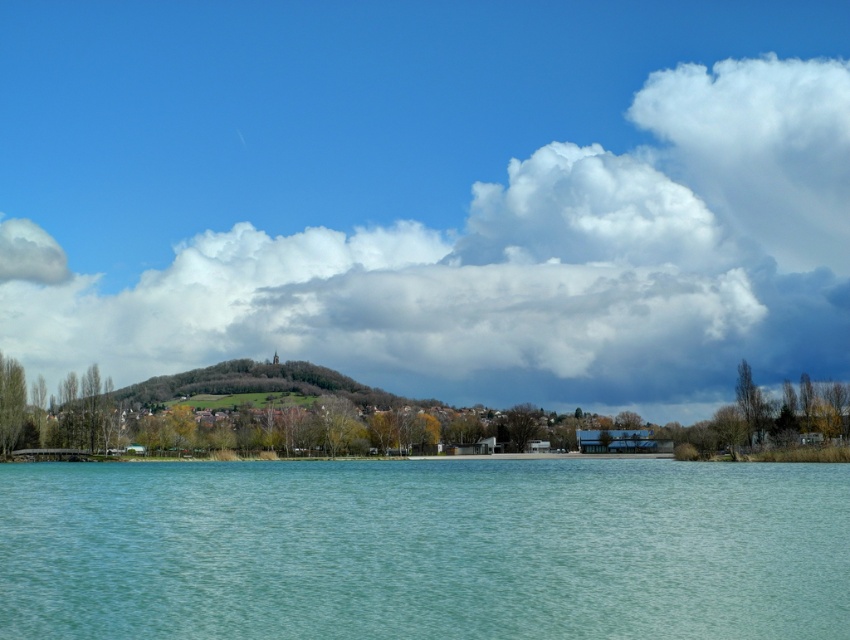
You are an artist planning to paint the scene. You want to ensure the white fluffy cloud at upper center and the clear water at center are proportionally accurate. Which object should you make larger in your painting?

The white fluffy cloud at upper center should be made larger than the clear water at center in the painting since it is described as larger in size.

You are an airplane passenger looking out the window and see the white fluffy cloud at upper center and the clear water at center. Which object is located to the left of the other?

The white fluffy cloud at upper center is positioned on the left side of clear water at center.

You are standing on the lakeside and looking towards the horizon. Which object, the white fluffy cloud at upper center or the clear water at center, is positioned higher in the sky?

The white fluffy cloud at upper center is positioned higher in the sky than the clear water at center.